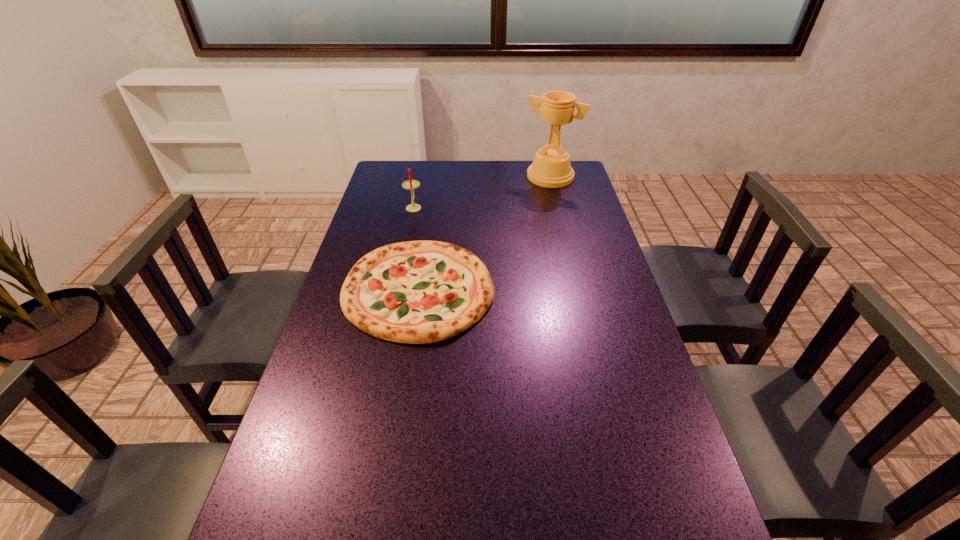
Locate an element on the screen. This screenshot has width=960, height=540. candle situated at the left edge is located at coordinates (410, 184).

Find the location of `pizza positioned at the left edge`. pizza positioned at the left edge is located at coordinates (417, 292).

Locate an element on the screen. object present at the right edge is located at coordinates (551, 168).

This screenshot has width=960, height=540. I want to click on object that is positioned at the far right corner, so point(551,168).

Image resolution: width=960 pixels, height=540 pixels. In the image, there is a desktop. Find the location of `free region at the far edge`. free region at the far edge is located at coordinates (495, 184).

I want to click on vacant space at the left edge of the desktop, so click(x=387, y=193).

This screenshot has width=960, height=540. In the image, there is a desktop. Find the location of `free space at the right edge`. free space at the right edge is located at coordinates (608, 246).

Where is `vacant space at the far right corner of the desktop`? This screenshot has width=960, height=540. vacant space at the far right corner of the desktop is located at coordinates point(574,188).

I want to click on vacant space that's between the tallest object and the candle, so click(x=482, y=192).

Where is `free space between the second nearest object and the tallest object`? The height and width of the screenshot is (540, 960). free space between the second nearest object and the tallest object is located at coordinates coord(482,192).